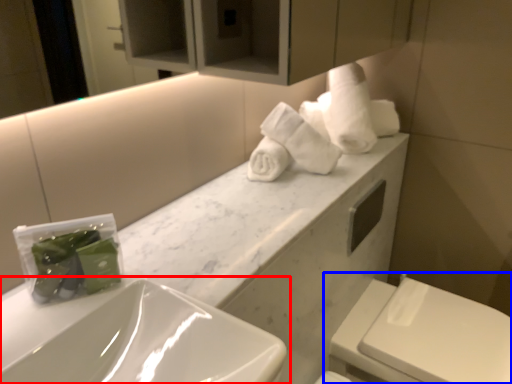
Question: Which object appears farthest to the camera in this image, sink (highlighted by a red box) or toilet (highlighted by a blue box)?

Choices:
 (A) sink
 (B) toilet

Answer: (B)